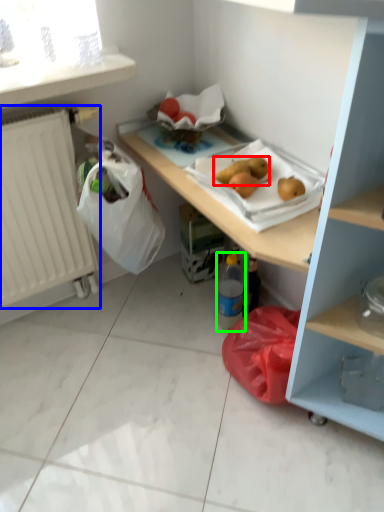
Question: Which is farther away from food (highlighted by a red box)? radiator (highlighted by a blue box) or bottle (highlighted by a green box)?

Choices:
 (A) radiator
 (B) bottle

Answer: (A)